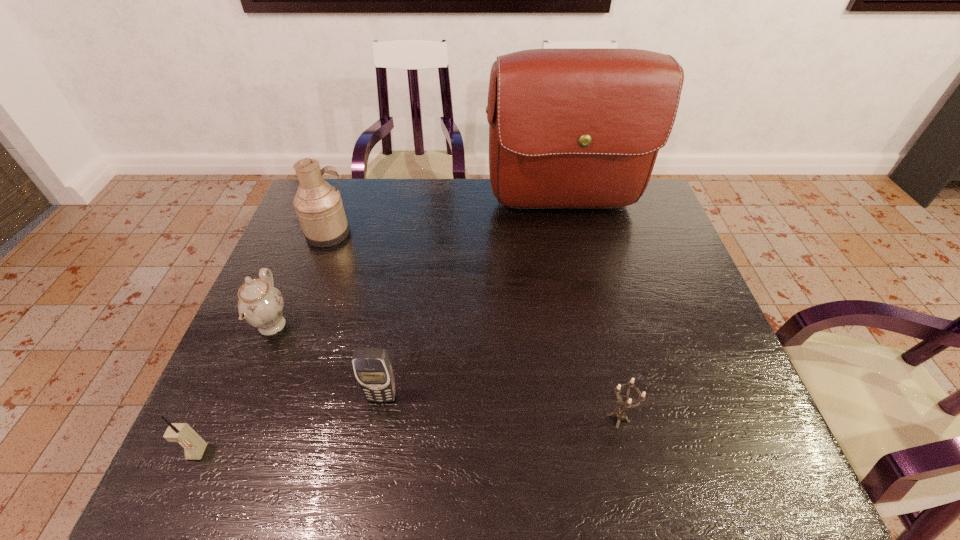
At what (x,y) coordinates should I click in order to perform the action: click on the tallest object. Please return your answer as a coordinate pair (x, y). This screenshot has width=960, height=540. Looking at the image, I should click on (568, 127).

The image size is (960, 540). I want to click on pitcher, so click(318, 205).

Locate an element on the screen. The height and width of the screenshot is (540, 960). the right cellular telephone is located at coordinates (373, 370).

Find the location of a particular element. the fourth farthest object is located at coordinates (373, 370).

The height and width of the screenshot is (540, 960). I want to click on chinaware, so 260,304.

Image resolution: width=960 pixels, height=540 pixels. In order to click on the nearest object in this screenshot , I will do `click(194, 446)`.

Where is `the left cellular telephone`? the left cellular telephone is located at coordinates (194, 446).

Image resolution: width=960 pixels, height=540 pixels. Identify the location of the shortest object. (620, 414).

Locate an element on the screen. candle holder is located at coordinates (620, 414).

Locate an element on the screen. vacant space located on the open flap of the tallest object is located at coordinates click(587, 307).